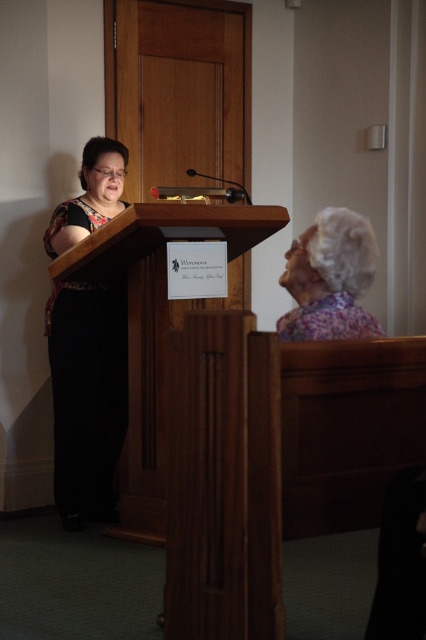
Is point (109, 289) more distant than point (218, 301)?

That is False.

Can you confirm if floral fabric dress at left is smaller than wooden podium at center?

Indeed, floral fabric dress at left has a smaller size compared to wooden podium at center.

The width and height of the screenshot is (426, 640). Describe the element at coordinates (86, 396) in the screenshot. I see `floral fabric dress at left` at that location.

Locate an element on the screen. The width and height of the screenshot is (426, 640). floral fabric dress at left is located at coordinates (86, 396).

Can you confirm if wooden podium at center is positioned to the right of floral fabric headscarf at upper right?

In fact, wooden podium at center is to the left of floral fabric headscarf at upper right.

Image resolution: width=426 pixels, height=640 pixels. Describe the element at coordinates (157, 324) in the screenshot. I see `wooden podium at center` at that location.

I want to click on wooden podium at center, so click(x=157, y=324).

Does floral fabric dress at left appear under floral fabric headscarf at upper right?

Yes, floral fabric dress at left is below floral fabric headscarf at upper right.

Which is above, floral fabric dress at left or floral fabric headscarf at upper right?

Positioned higher is floral fabric headscarf at upper right.

Consider the image. Who is more forward, (112, 429) or (316, 269)?

Positioned in front is point (316, 269).

Identify the location of floral fabric dress at left. (86, 396).